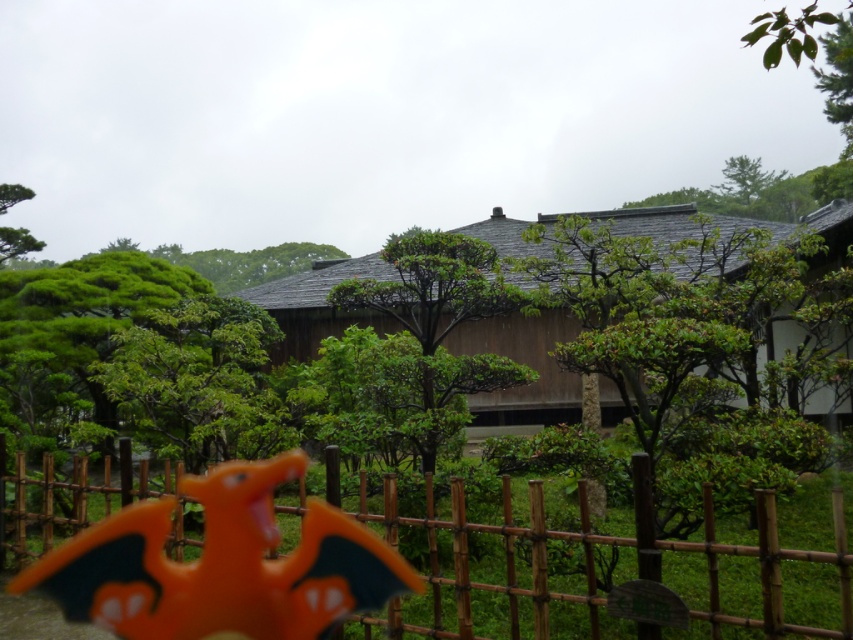
Question: Estimate the real-world distances between objects in this image. Which object is closer to the brown wooden hut at center?

Choices:
 (A) orange matte plastic dragon at lower left
 (B) green leafy tree at upper center
 (C) bamboo fence at lower center
 (D) green matte tree at center

Answer: (D)

Question: Does green leafy tree at upper center have a smaller size compared to green leafy tree at upper left?

Choices:
 (A) yes
 (B) no

Answer: (B)

Question: Can you confirm if bamboo fence at lower center is positioned to the left of brown wooden hut at center?

Choices:
 (A) yes
 (B) no

Answer: (A)

Question: Can you confirm if green matte tree at center is positioned to the right of green leafy tree at center?

Choices:
 (A) yes
 (B) no

Answer: (A)

Question: Which point is closer to the camera?

Choices:
 (A) (389, 321)
 (B) (263, 577)
 (C) (689, 540)

Answer: (B)

Question: Which point is farther to the camera?

Choices:
 (A) green leafy tree at upper left
 (B) brown wooden hut at center

Answer: (A)